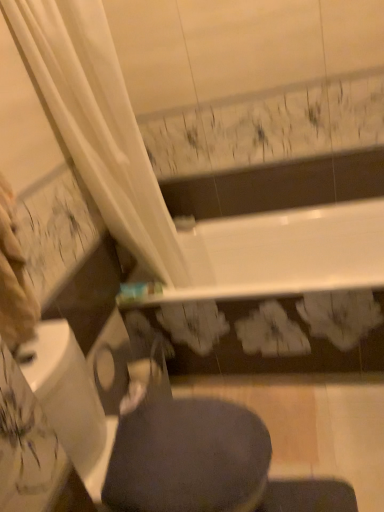
Question: Considering the relative positions of dark gray fabric at lower center and dark gray fabric swivel chair at lower center in the image provided, is dark gray fabric at lower center to the right of dark gray fabric swivel chair at lower center from the viewer's perspective?

Choices:
 (A) yes
 (B) no

Answer: (A)

Question: Would you say dark gray fabric swivel chair at lower center is part of dark gray fabric at lower center's contents?

Choices:
 (A) yes
 (B) no

Answer: (B)

Question: Is dark gray fabric at lower center at the left side of dark gray fabric swivel chair at lower center?

Choices:
 (A) no
 (B) yes

Answer: (A)

Question: Is dark gray fabric at lower center shorter than dark gray fabric swivel chair at lower center?

Choices:
 (A) yes
 (B) no

Answer: (A)

Question: Is the position of dark gray fabric at lower center less distant than that of dark gray fabric swivel chair at lower center?

Choices:
 (A) no
 (B) yes

Answer: (A)

Question: From a real-world perspective, is dark gray fabric at lower center beneath dark gray fabric swivel chair at lower center?

Choices:
 (A) no
 (B) yes

Answer: (A)

Question: Is dark gray fabric swivel chair at lower center further to camera compared to dark gray fabric at lower center?

Choices:
 (A) no
 (B) yes

Answer: (A)

Question: Does dark gray fabric swivel chair at lower center touch dark gray fabric at lower center?

Choices:
 (A) yes
 (B) no

Answer: (A)

Question: From the image's perspective, is dark gray fabric swivel chair at lower center on top of dark gray fabric at lower center?

Choices:
 (A) no
 (B) yes

Answer: (A)

Question: Can you confirm if dark gray fabric swivel chair at lower center is shorter than dark gray fabric at lower center?

Choices:
 (A) yes
 (B) no

Answer: (B)

Question: Could you tell me if dark gray fabric swivel chair at lower center is facing dark gray fabric at lower center?

Choices:
 (A) no
 (B) yes

Answer: (B)

Question: Is dark gray fabric swivel chair at lower center in front of dark gray fabric at lower center?

Choices:
 (A) yes
 (B) no

Answer: (A)

Question: Is dark gray fabric swivel chair at lower center to the left or to the right of dark gray fabric at lower center in the image?

Choices:
 (A) left
 (B) right

Answer: (A)